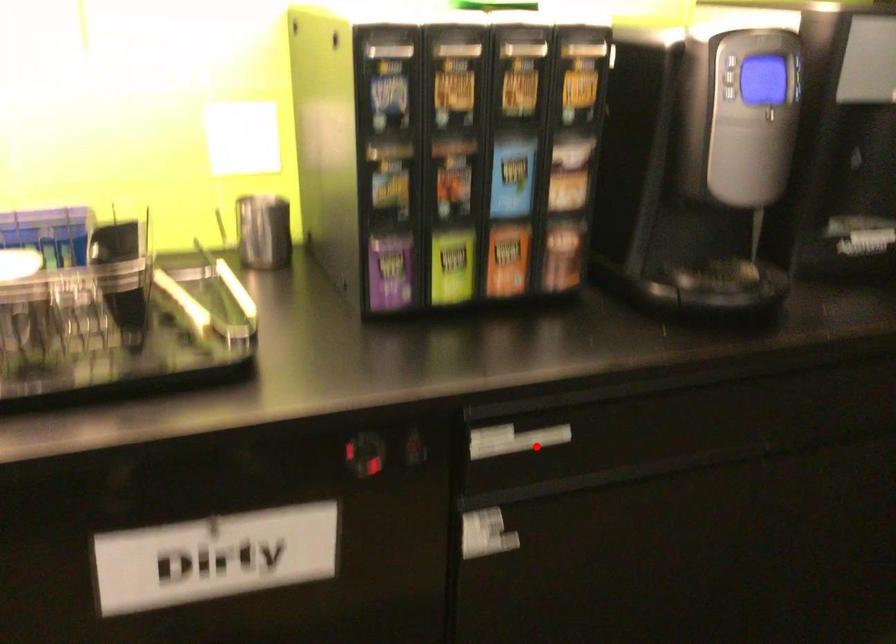
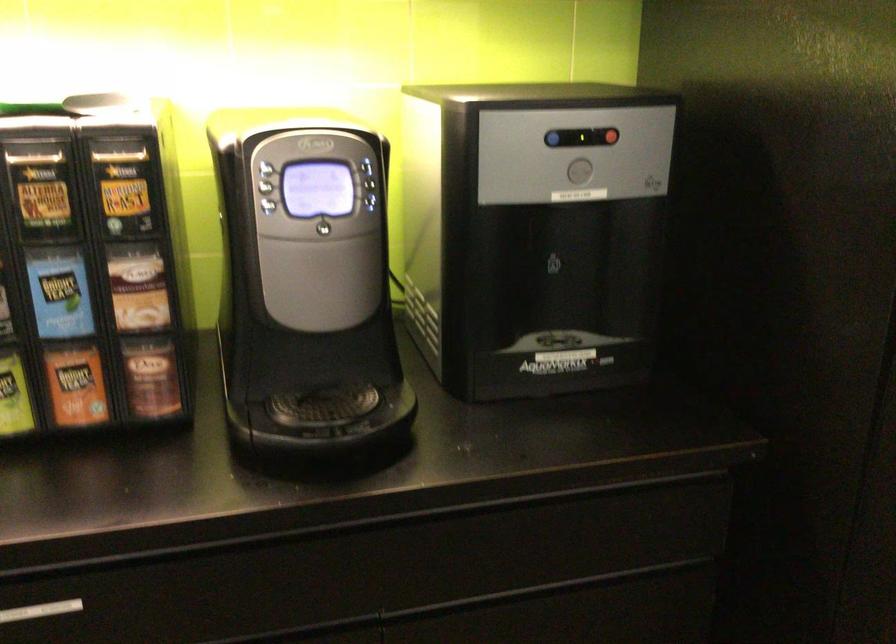
In the second image, find the point that corresponds to the highlighted location in the first image.

(40, 611)